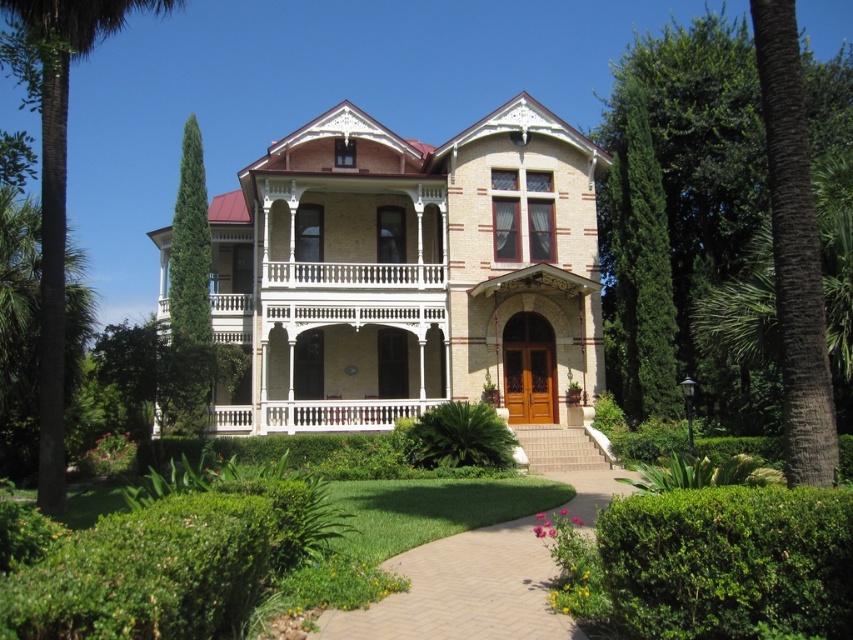
Is point (341, 637) farther from camera compared to point (368, 420)?

No, it is in front of (368, 420).

Who is positioned more to the left, brick pathway at center or white wood porch at center?

From the viewer's perspective, white wood porch at center appears more on the left side.

What do you see at coordinates (463, 592) in the screenshot?
I see `brick pathway at center` at bounding box center [463, 592].

Identify the location of brick pathway at center. Image resolution: width=853 pixels, height=640 pixels. (463, 592).

Identify the location of green leafy tree at right. (706, 186).

Does point (717, 216) lie behind point (20, 67)?

Yes, point (717, 216) is farther from viewer.

Identify the location of green leafy tree at right. This screenshot has height=640, width=853. (706, 186).

Between point (521, 598) and point (41, 465), which one is positioned behind?

Positioned behind is point (41, 465).

Is brick pathway at center wider than green leafy palm tree at left?

Yes.

The height and width of the screenshot is (640, 853). What are the coordinates of `brick pathway at center` in the screenshot? It's located at (463, 592).